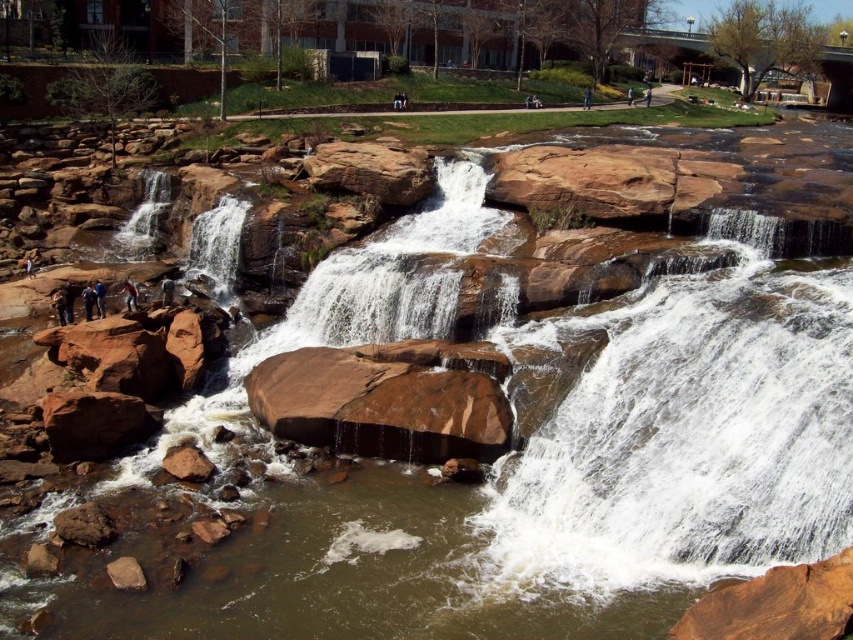
Does smooth brown rock at center have a greater height compared to blue denim jeans at lower left?

Yes, smooth brown rock at center is taller than blue denim jeans at lower left.

Who is lower down, smooth brown rock at center or blue denim jeans at lower left?

smooth brown rock at center is below.

Is point (544, 484) closer to viewer compared to point (102, 294)?

Yes, point (544, 484) is closer to viewer.

You are a GUI agent. You are given a task and a screenshot of the screen. Output one action in this format:
    pyautogui.click(x=<x>, y=<y>)
    Task: Click on the smooth brown rock at center
    This screenshot has height=640, width=853.
    Given the screenshot: What is the action you would take?
    pyautogui.click(x=683, y=438)

Can you confirm if brown rough rock at lower left is positioned above brown leather jacket at center?

No.

This screenshot has width=853, height=640. What do you see at coordinates (187, 461) in the screenshot?
I see `brown rough rock at lower left` at bounding box center [187, 461].

Identify the location of brown rough rock at lower left. This screenshot has height=640, width=853. (187, 461).

Is white smooth waterfall at left to the left of dark brown leather jacket at left from the viewer's perspective?

Correct, you'll find white smooth waterfall at left to the left of dark brown leather jacket at left.

Which is in front, point (154, 182) or point (61, 324)?

Point (61, 324) is more forward.

At what (x,y) coordinates should I click in order to perform the action: click on white smooth waterfall at left. Please return your answer as a coordinate pair (x, y). This screenshot has width=853, height=640. Looking at the image, I should click on (144, 216).

Identify the location of white smooth waterfall at left. tap(144, 216).